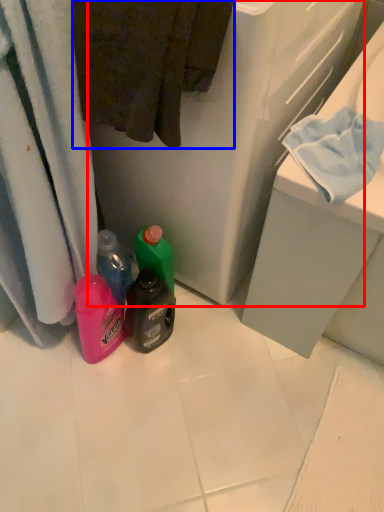
Question: Which object appears farthest to the camera in this image, appliance (highlighted by a red box) or bath towel (highlighted by a blue box)?

Choices:
 (A) appliance
 (B) bath towel

Answer: (A)